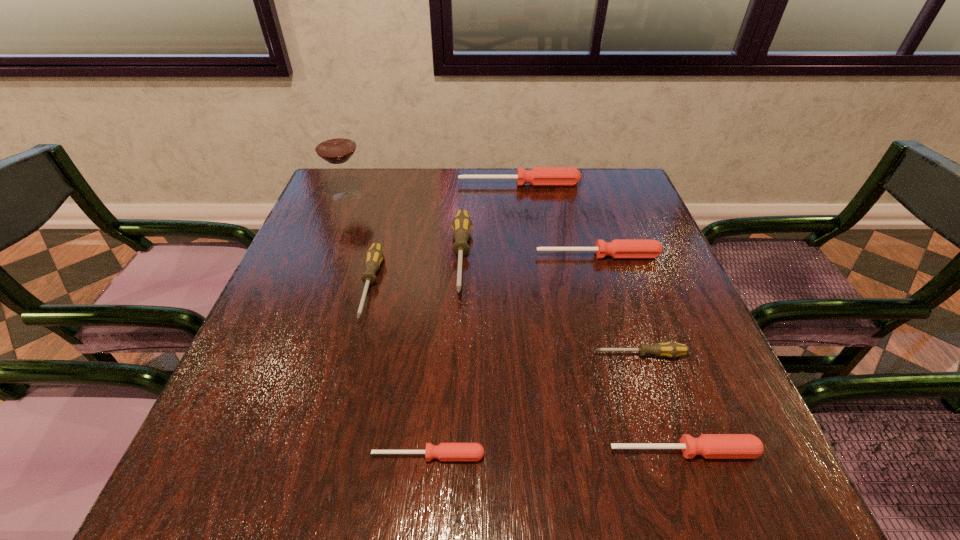
Where is `the sixth farthest object`? This screenshot has height=540, width=960. the sixth farthest object is located at coordinates (670, 349).

The height and width of the screenshot is (540, 960). Find the location of `the shortest screwdriver`. the shortest screwdriver is located at coordinates point(444,451).

Where is `the smallest red screwdriver`? This screenshot has width=960, height=540. the smallest red screwdriver is located at coordinates (444, 451).

Locate an element on the screen. The height and width of the screenshot is (540, 960). free space located 0.330m on the right of the tallest object is located at coordinates (481, 196).

Where is `free space located at the tip of the biggest gray screwdriver`? The width and height of the screenshot is (960, 540). free space located at the tip of the biggest gray screwdriver is located at coordinates (456, 357).

You are a GUI agent. You are given a task and a screenshot of the screen. Output one action in this format:
    pyautogui.click(x=<x>, y=<y>)
    Task: Click on the blank space located on the right of the biggest red screwdriver
    This screenshot has width=960, height=540.
    Given the screenshot: What is the action you would take?
    pyautogui.click(x=616, y=184)

Locate an element on the screen. vacant space located 0.150m at the tip of the second biggest gray screwdriver is located at coordinates tap(344, 389).

Identify the location of free space located on the front of the third smallest red screwdriver. (626, 348).

The height and width of the screenshot is (540, 960). Find the location of `vacant area situated on the left of the third biggest red screwdriver`. vacant area situated on the left of the third biggest red screwdriver is located at coordinates (480, 451).

Identify the location of free spot located 0.260m at the tip of the rightmost gray screwdriver. The width and height of the screenshot is (960, 540). (460, 355).